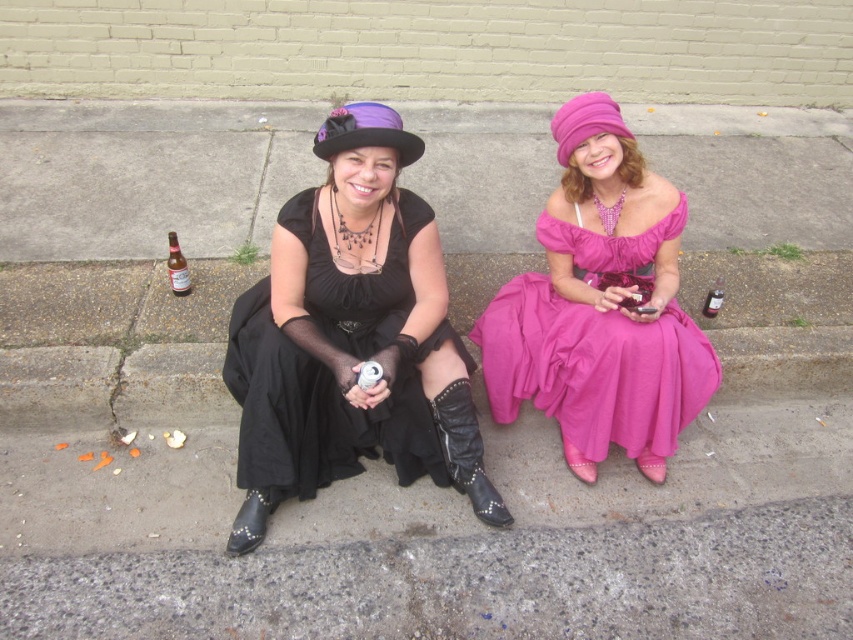
Question: Among these objects, which one is nearest to the camera?

Choices:
 (A) pink felt hat at upper right
 (B) brown glass bottle at lower left

Answer: (A)

Question: Among these objects, which one is farthest from the camera?

Choices:
 (A) matte pink satin dress at center
 (B) pink felt hat at upper right

Answer: (B)

Question: Does studded leather boot at lower center have a lesser width compared to pink felt hat at upper right?

Choices:
 (A) no
 (B) yes

Answer: (A)

Question: Is black satin dress at center smaller than brown glass bottle at lower left?

Choices:
 (A) yes
 (B) no

Answer: (B)

Question: Is pink felt hat at upper right further to camera compared to brown glass bottle at lower left?

Choices:
 (A) no
 (B) yes

Answer: (A)

Question: Which is nearer to the pink felt hat at upper right?

Choices:
 (A) black satin dress at center
 (B) studded leather boot at lower center

Answer: (B)